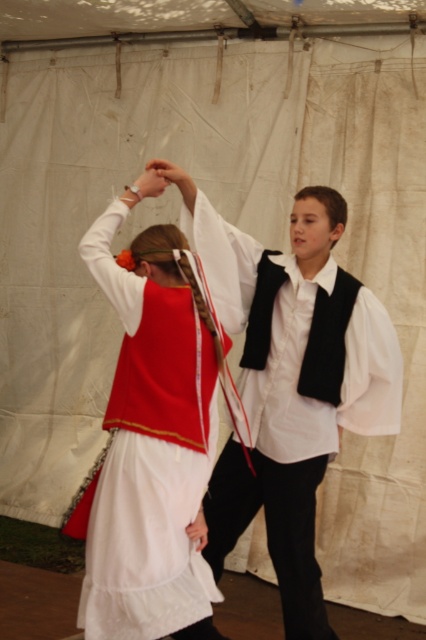
Question: Which object appears closest to the camera in this image?

Choices:
 (A) white matte vest at center
 (B) matte red vest at center

Answer: (B)

Question: Among these points, which one is nearest to the camera?

Choices:
 (A) (302, 342)
 (B) (115, 224)

Answer: (B)

Question: Can you confirm if white matte vest at center is positioned to the left of matte red vest at center?

Choices:
 (A) yes
 (B) no

Answer: (B)

Question: Can you confirm if white matte vest at center is positioned above matte red vest at center?

Choices:
 (A) no
 (B) yes

Answer: (A)

Question: Does white matte vest at center appear under matte red vest at center?

Choices:
 (A) yes
 (B) no

Answer: (A)